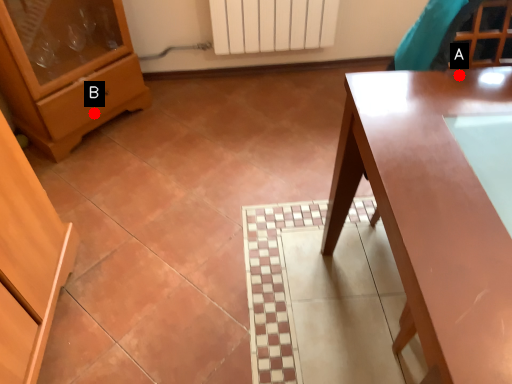
Question: Two points are circled on the image, labeled by A and B beside each circle. Which point appears farthest from the camera in this image?

Choices:
 (A) A is further
 (B) B is further

Answer: (B)